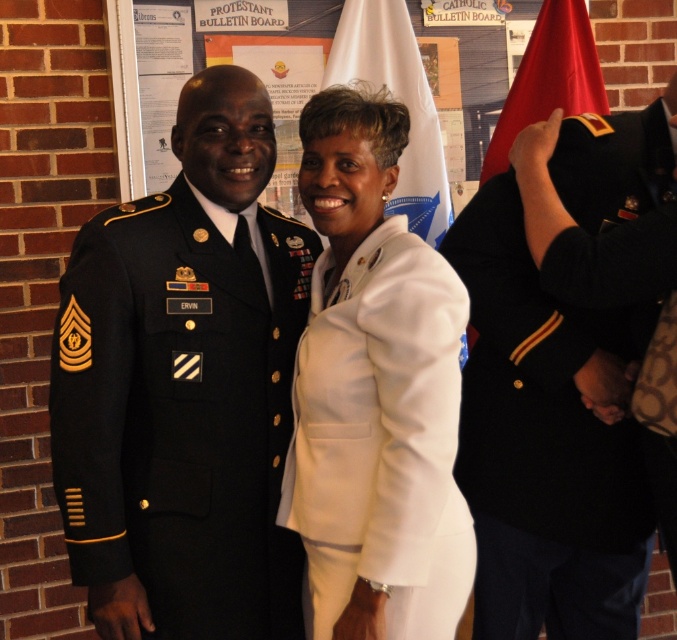
The height and width of the screenshot is (640, 677). What are the coordinates of `white smooth suit at center` in the screenshot? It's located at (374, 394).

Who is taller, white smooth suit at center or shiny red flag at upper right?

With more height is white smooth suit at center.

Between point (301, 173) and point (592, 38), which one is positioned behind?

The point (592, 38) is more distant.

Where is `white smooth suit at center`? This screenshot has width=677, height=640. white smooth suit at center is located at coordinates (374, 394).

Does point (108, 321) come in front of point (498, 388)?

Yes, it is.

Between dark green fabric military uniform at left and navy blue wool military uniform at right, which one appears on the left side from the viewer's perspective?

From the viewer's perspective, dark green fabric military uniform at left appears more on the left side.

What do you see at coordinates (179, 413) in the screenshot?
I see `dark green fabric military uniform at left` at bounding box center [179, 413].

In order to click on dark green fabric military uniform at left in this screenshot , I will do `click(179, 413)`.

Between dark green fabric military uniform at left and shiny red flag at upper right, which one is positioned lower?

dark green fabric military uniform at left is lower down.

Measure the distance between dark green fabric military uniform at left and shiny red flag at upper right.

dark green fabric military uniform at left is 37.65 inches from shiny red flag at upper right.

What do you see at coordinates (179, 413) in the screenshot?
I see `dark green fabric military uniform at left` at bounding box center [179, 413].

In order to click on dark green fabric military uniform at left in this screenshot , I will do `click(179, 413)`.